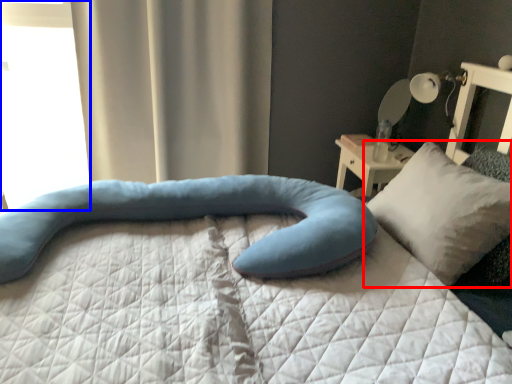
Question: Which object is closer to the camera taking this photo, pillow (highlighted by a red box) or window (highlighted by a blue box)?

Choices:
 (A) pillow
 (B) window

Answer: (A)